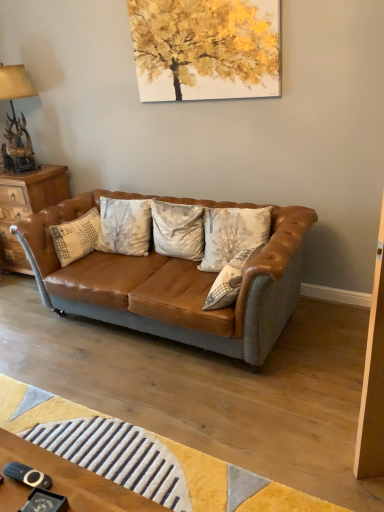
Question: Is antler bronze lamp at upper left positioned behind leather couch at center?

Choices:
 (A) yes
 (B) no

Answer: (A)

Question: Considering the relative sizes of antler bronze lamp at upper left and leather couch at center in the image provided, is antler bronze lamp at upper left thinner than leather couch at center?

Choices:
 (A) yes
 (B) no

Answer: (A)

Question: Is antler bronze lamp at upper left shorter than leather couch at center?

Choices:
 (A) yes
 (B) no

Answer: (A)

Question: From the image's perspective, is antler bronze lamp at upper left located beneath leather couch at center?

Choices:
 (A) no
 (B) yes

Answer: (A)

Question: Considering the relative sizes of antler bronze lamp at upper left and leather couch at center in the image provided, is antler bronze lamp at upper left bigger than leather couch at center?

Choices:
 (A) no
 (B) yes

Answer: (A)

Question: From the image's perspective, is silky beige pillow at center, the third pillow when ordered from right to left, above or below leather couch at center?

Choices:
 (A) below
 (B) above

Answer: (B)

Question: Considering the positions of silky beige pillow at center, the third pillow when ordered from right to left, and leather couch at center in the image, is silky beige pillow at center, the third pillow when ordered from right to left, bigger or smaller than leather couch at center?

Choices:
 (A) small
 (B) big

Answer: (A)

Question: From a real-world perspective, relative to leather couch at center, is silky beige pillow at center, the third pillow when ordered from right to left, vertically above or below?

Choices:
 (A) above
 (B) below

Answer: (A)

Question: Considering the positions of silky beige pillow at center, the third pillow when ordered from right to left, and leather couch at center in the image, is silky beige pillow at center, the third pillow when ordered from right to left, wider or thinner than leather couch at center?

Choices:
 (A) wide
 (B) thin

Answer: (B)

Question: Is textured beige pillow at center, marked as the 4th pillow in a left-to-right arrangement, spatially inside leather couch at center, or outside of it?

Choices:
 (A) inside
 (B) outside

Answer: (A)

Question: From a real-world perspective, is textured beige pillow at center, the first pillow positioned from the right, positioned above or below leather couch at center?

Choices:
 (A) above
 (B) below

Answer: (A)

Question: Considering their positions, is textured beige pillow at center, the first pillow positioned from the right, located in front of or behind leather couch at center?

Choices:
 (A) front
 (B) behind

Answer: (B)

Question: In terms of width, does textured beige pillow at center, the first pillow positioned from the right, look wider or thinner when compared to leather couch at center?

Choices:
 (A) wide
 (B) thin

Answer: (B)

Question: Would you say textured beige pillow at center, which is counted as the third pillow, starting from the left, is to the left or to the right of white textured pillow at center, the first pillow when ordered from left to right, in the picture?

Choices:
 (A) right
 (B) left

Answer: (A)

Question: Looking at the image, does textured beige pillow at center, which is counted as the third pillow, starting from the left, seem bigger or smaller compared to white textured pillow at center, the first pillow when ordered from left to right?

Choices:
 (A) big
 (B) small

Answer: (A)